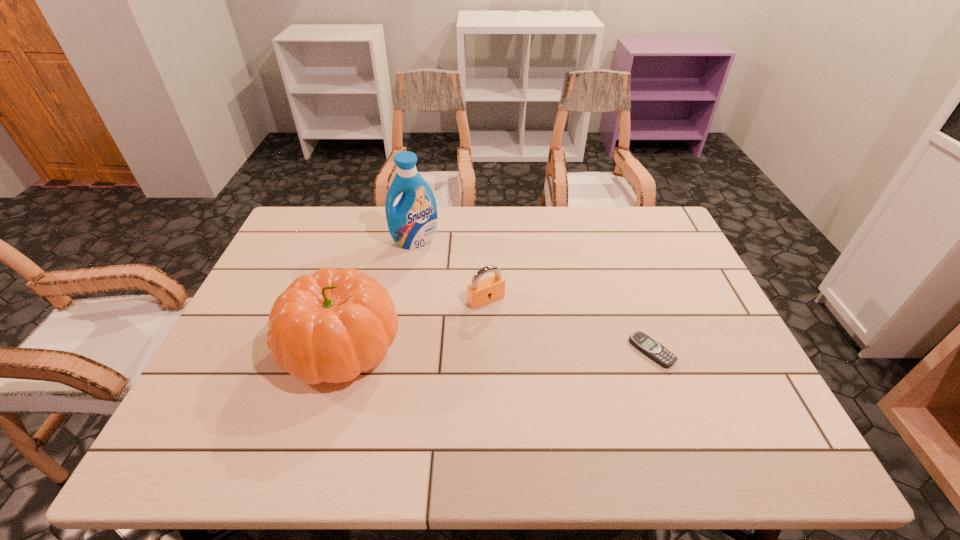
Locate an element on the screen. Image resolution: width=960 pixels, height=540 pixels. vacant position at the near edge of the desktop is located at coordinates (475, 407).

You are a GUI agent. You are given a task and a screenshot of the screen. Output one action in this format:
    pyautogui.click(x=<x>, y=<y>)
    Task: Click on the vacant space at the right edge of the desktop
    This screenshot has height=540, width=960.
    Given the screenshot: What is the action you would take?
    pyautogui.click(x=686, y=266)

Where is `blank region between the rightmost object and the farthest object`? This screenshot has height=540, width=960. blank region between the rightmost object and the farthest object is located at coordinates (533, 296).

Identify the location of vacant region between the third object from left to right and the farthest object. (451, 271).

Identify the location of vacant space in between the pumpkin and the third tallest object. This screenshot has height=540, width=960. (414, 323).

Locate an element on the screen. The height and width of the screenshot is (540, 960). vacant area that lies between the second object from right to left and the beeper is located at coordinates (568, 325).

Identify the location of vacant area that lies between the rightmost object and the second shortest object. (568, 325).

The width and height of the screenshot is (960, 540). In order to click on free point between the third tallest object and the rightmost object in this screenshot , I will do `click(568, 325)`.

Locate an element on the screen. This screenshot has width=960, height=540. free point between the third tallest object and the third shortest object is located at coordinates (414, 323).

Image resolution: width=960 pixels, height=540 pixels. I want to click on vacant area between the pumpkin and the third object from left to right, so click(x=414, y=323).